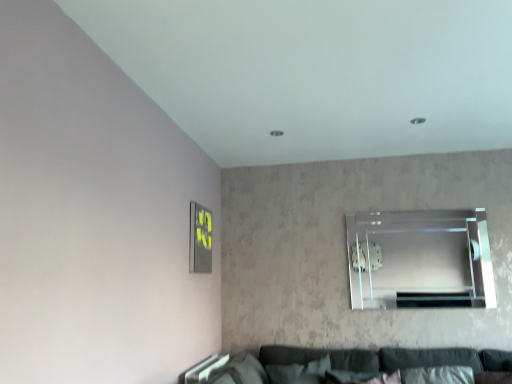
Question: From a real-world perspective, is metallic gray picture frame at lower left over clear glass window at upper right?

Choices:
 (A) no
 (B) yes

Answer: (B)

Question: Is metallic gray picture frame at lower left facing towards clear glass window at upper right?

Choices:
 (A) yes
 (B) no

Answer: (A)

Question: Is the position of metallic gray picture frame at lower left less distant than that of clear glass window at upper right?

Choices:
 (A) no
 (B) yes

Answer: (B)

Question: Is metallic gray picture frame at lower left in contact with clear glass window at upper right?

Choices:
 (A) yes
 (B) no

Answer: (B)

Question: Is metallic gray picture frame at lower left taller than clear glass window at upper right?

Choices:
 (A) yes
 (B) no

Answer: (B)

Question: From the image's perspective, is metallic gray picture frame at lower left located above clear glass window at upper right?

Choices:
 (A) no
 (B) yes

Answer: (B)

Question: From a real-world perspective, is clear glass window at upper right located beneath metallic gray picture frame at lower left?

Choices:
 (A) no
 (B) yes

Answer: (B)

Question: Is metallic gray picture frame at lower left a part of clear glass window at upper right?

Choices:
 (A) yes
 (B) no

Answer: (B)

Question: Does clear glass window at upper right have a lesser height compared to metallic gray picture frame at lower left?

Choices:
 (A) no
 (B) yes

Answer: (A)

Question: Is clear glass window at upper right further to camera compared to metallic gray picture frame at lower left?

Choices:
 (A) yes
 (B) no

Answer: (A)

Question: Can you confirm if clear glass window at upper right is wider than metallic gray picture frame at lower left?

Choices:
 (A) yes
 (B) no

Answer: (B)

Question: From a real-world perspective, is clear glass window at upper right on top of metallic gray picture frame at lower left?

Choices:
 (A) no
 (B) yes

Answer: (A)

Question: Is clear glass window at upper right spatially inside metallic gray picture frame at lower left, or outside of it?

Choices:
 (A) outside
 (B) inside

Answer: (A)